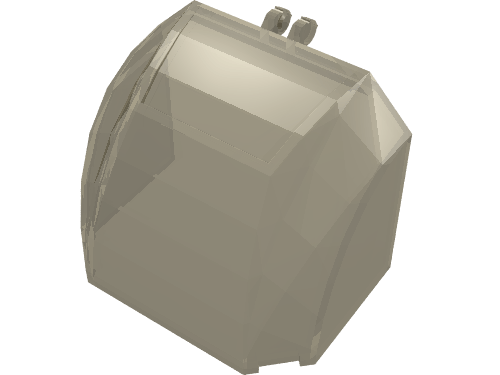
The image size is (500, 375). I want to click on right corner, so click(x=172, y=155).